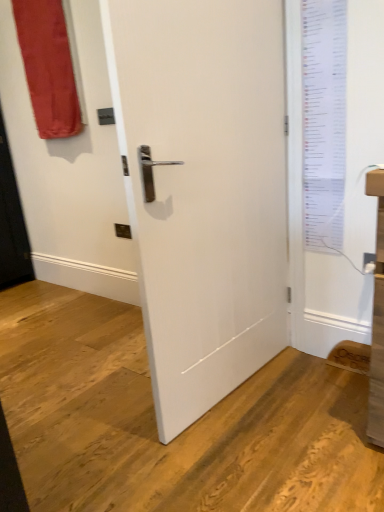
Question: From a real-world perspective, is white paper list at upper right positioned above or below white matte door at center?

Choices:
 (A) above
 (B) below

Answer: (A)

Question: Which is correct: white paper list at upper right is inside white matte door at center, or outside of it?

Choices:
 (A) outside
 (B) inside

Answer: (A)

Question: Which is farther from the white matte door at center?

Choices:
 (A) white paper list at upper right
 (B) matte red curtain at upper left

Answer: (B)

Question: Which is nearer to the matte red curtain at upper left?

Choices:
 (A) white matte door at center
 (B) white paper list at upper right

Answer: (A)